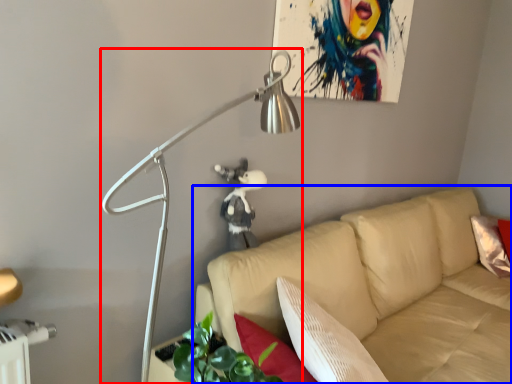
Question: Which object appears farthest to the camera in this image, lamp (highlighted by a red box) or studio couch (highlighted by a blue box)?

Choices:
 (A) lamp
 (B) studio couch

Answer: (B)